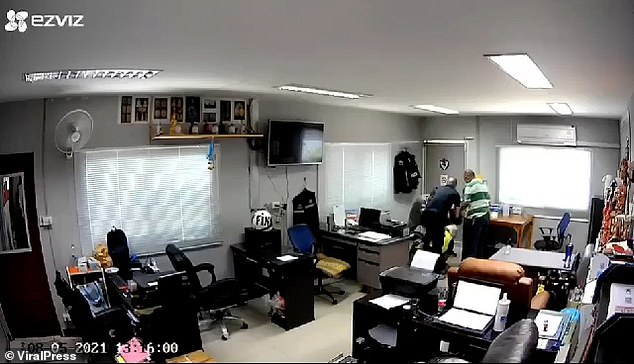
The height and width of the screenshot is (364, 634). Find the location of `chair`. chair is located at coordinates (215, 293).